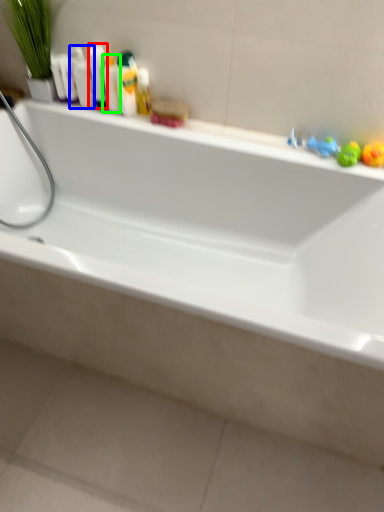
Question: Estimate the real-world distances between objects in this image. Which object is farther from toiletry (highlighted by a red box), mouthwash (highlighted by a blue box) or mouthwash (highlighted by a green box)?

Choices:
 (A) mouthwash
 (B) mouthwash

Answer: (A)